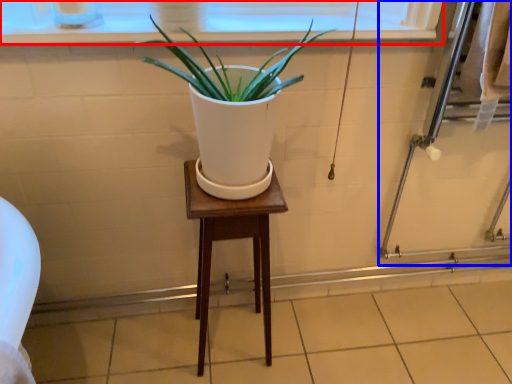
Question: Among these objects, which one is nearest to the camera, window frame (highlighted by a red box) or screen door (highlighted by a blue box)?

Choices:
 (A) window frame
 (B) screen door

Answer: (A)